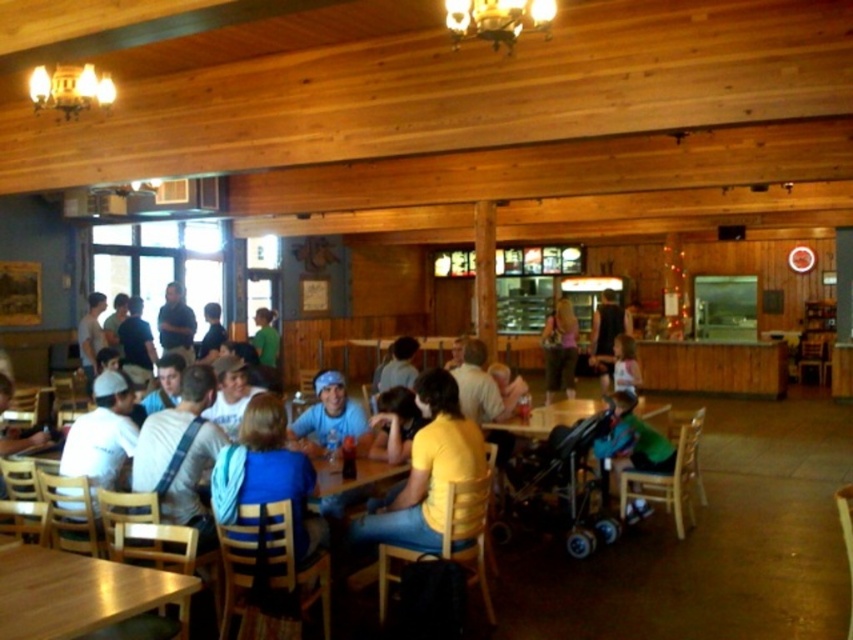
You are a customer entering the restaurant and need to find a seat. You see the yellow matte shirt at center and the wooden table at center. Which object is bigger in size?

The yellow matte shirt at center is larger in size compared to the wooden table at center.

You are a customer at the restaurant and want to order a drink. The staff members are wearing a yellow matte shirt at center and a light blue shirt at center. Which staff member should you approach if you want to reach the one closer to the counter?

The staff member wearing the yellow matte shirt at center is closer to the counter because the yellow matte shirt at center might be wider than light blue shirt at center.

You are a customer entering the restaurant and want to greet the staff member wearing the yellow matte shirt at center. Since you are standing at the wooden table at center, can you see the staff member clearly without any obstruction?

The yellow matte shirt at center has a greater height compared to wooden table at center, so yes, you can see the staff member wearing the yellow matte shirt at center clearly because they are taller than the wooden table at center.